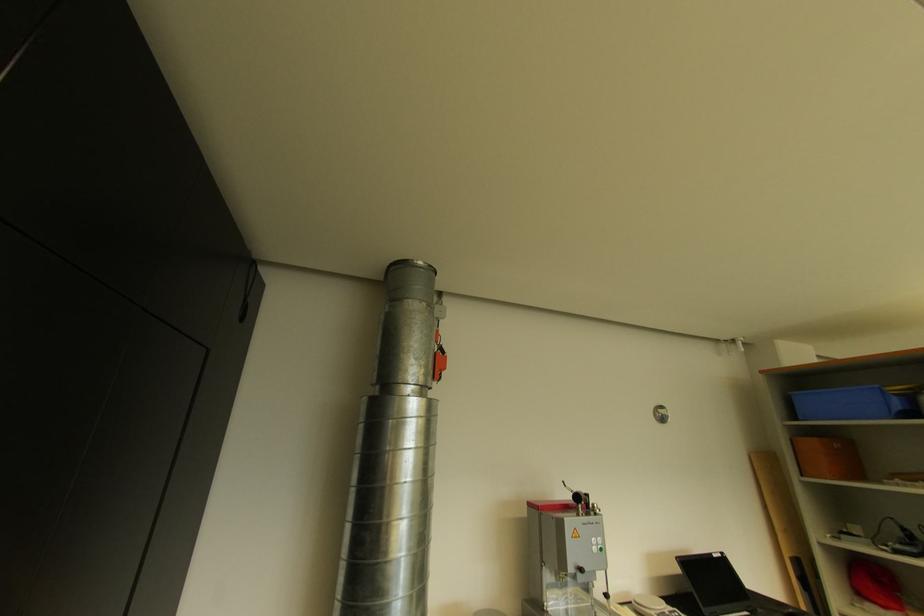
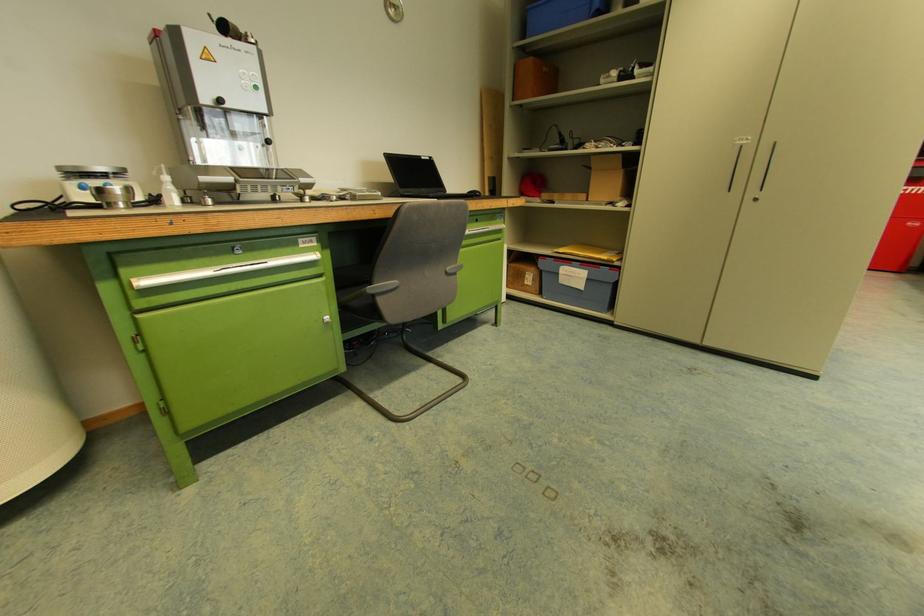
Where in the second image is the point corresponding to pixel 602 546 from the first image?

(257, 84)